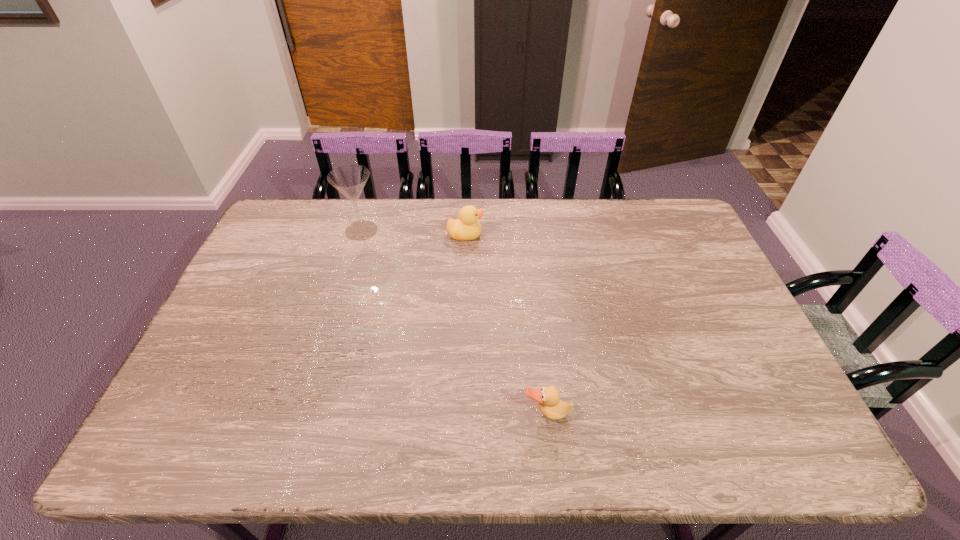
Where is `duck present at the far edge`? duck present at the far edge is located at coordinates (467, 227).

Locate an element on the screen. This screenshot has width=960, height=540. object that is positioned at the near edge is located at coordinates (548, 398).

This screenshot has height=540, width=960. In the image, there is a desktop. Find the location of `free space at the far edge`. free space at the far edge is located at coordinates (440, 217).

The image size is (960, 540). Find the location of `free location at the near edge`. free location at the near edge is located at coordinates (427, 423).

In order to click on vacant space at the right edge of the desktop in this screenshot , I will do `click(699, 332)`.

Image resolution: width=960 pixels, height=540 pixels. In order to click on vacant space at the far left corner in this screenshot , I will do `click(300, 228)`.

This screenshot has width=960, height=540. In the image, there is a desktop. Identify the location of free region at the near right corner. (808, 456).

Find the location of a particular element. The width and height of the screenshot is (960, 540). free point between the leftmost object and the left duck is located at coordinates [414, 233].

You are a GUI agent. You are given a task and a screenshot of the screen. Output one action in this format:
    pyautogui.click(x=<x>, y=<y>)
    Task: Click on the blank region between the rightmost object and the leftmost object
    
    Given the screenshot: What is the action you would take?
    pyautogui.click(x=454, y=322)

Locate an element on the screen. The width and height of the screenshot is (960, 540). unoccupied position between the nearer duck and the left duck is located at coordinates (506, 324).